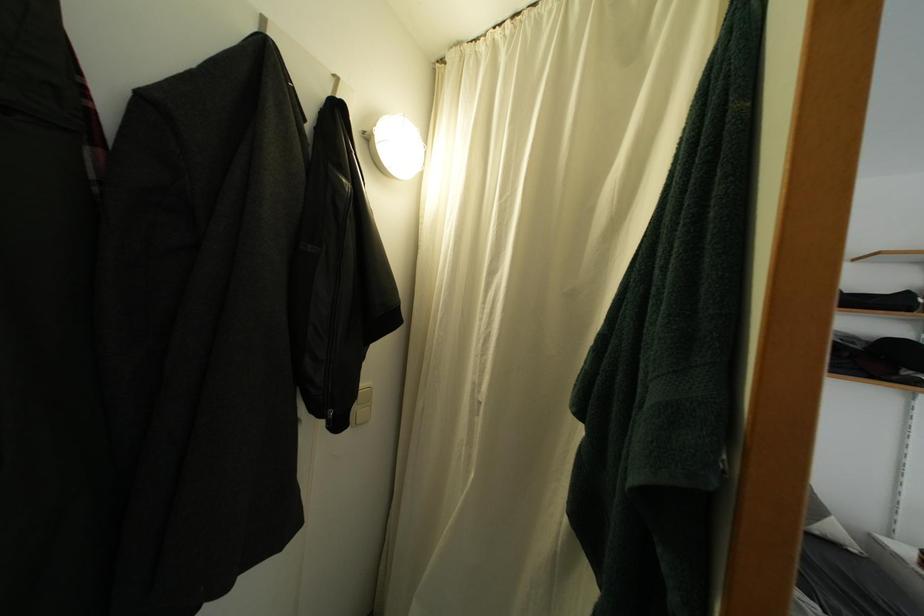
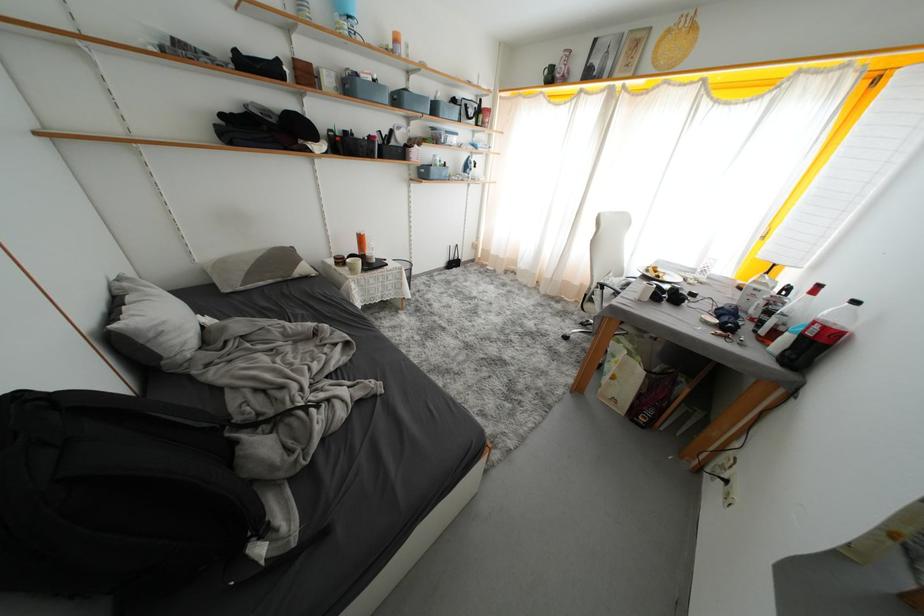
Based on the continuous images, in which direction is the camera rotating?

The camera's rotation is toward right-down.